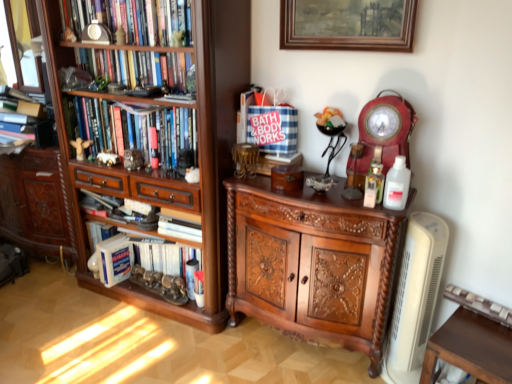
At what (x,y) coordinates should I click in order to perform the action: click on free space in front of wooden bookshelf at left. Please return your answer as a coordinate pair (x, y). The width and height of the screenshot is (512, 384). Looking at the image, I should click on (138, 349).